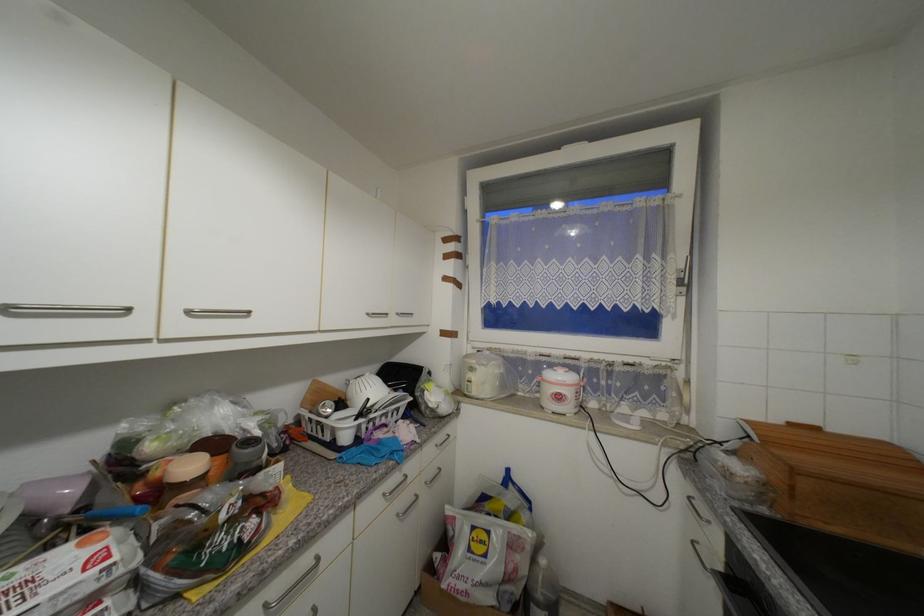
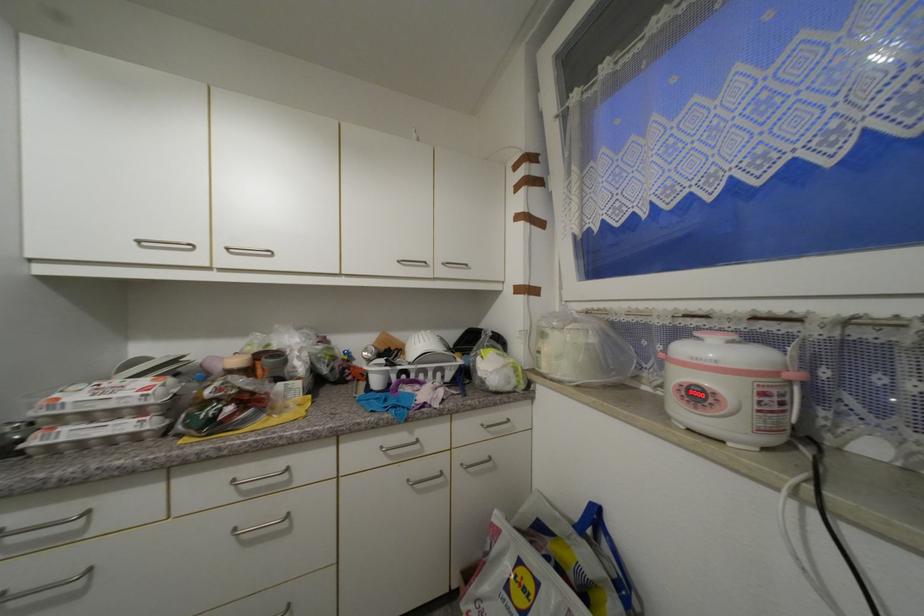
Question: The first image is from the beginning of the video and the second image is from the end. How did the camera likely rotate when shooting the video?

Choices:
 (A) Left
 (B) Right
 (C) Up
 (D) Down

Answer: (A)